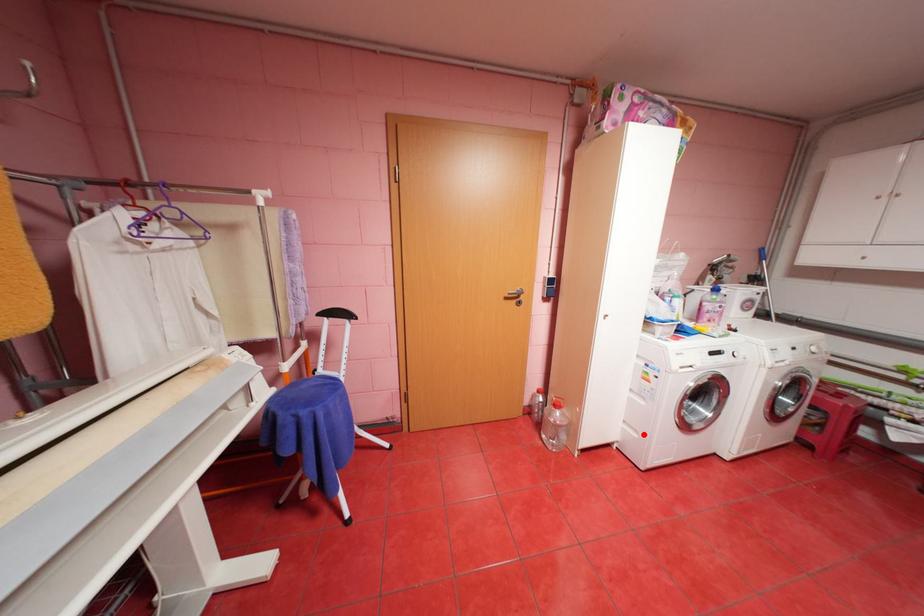
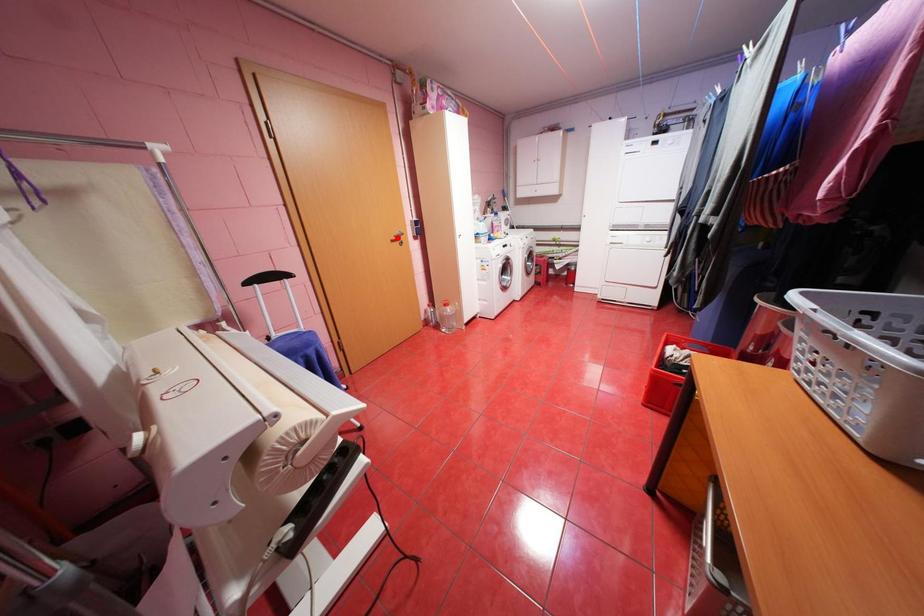
I am providing you with two images of the same scene from different viewpoints. A red point is marked on the first image and another point is marked on the second image. Does the point marked in image1 correspond to the same location as the one in image2?

No